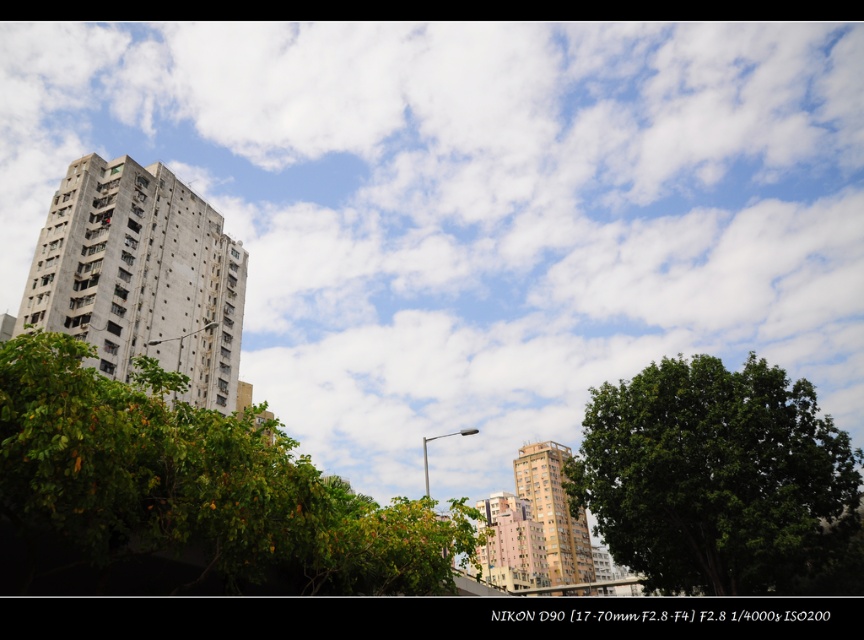
Can you confirm if green leafy tree at center is positioned above pink matte building at center?

Correct, green leafy tree at center is located above pink matte building at center.

The width and height of the screenshot is (864, 640). Find the location of `green leafy tree at center`. green leafy tree at center is located at coordinates (718, 480).

Which is in front, point (734, 387) or point (162, 292)?

Positioned in front is point (734, 387).

Can you confirm if green leafy tree at center is bigger than gray concrete building at left?

No, green leafy tree at center is not bigger than gray concrete building at left.

Is point (672, 444) behind point (98, 298)?

That is False.

Locate an element on the screen. green leafy tree at center is located at coordinates (718, 480).

Is green leafy tree at lower left thinner than green leafy tree at center?

No.

What do you see at coordinates (195, 484) in the screenshot? I see `green leafy tree at lower left` at bounding box center [195, 484].

The image size is (864, 640). What are the coordinates of `green leafy tree at lower left` in the screenshot? It's located at (195, 484).